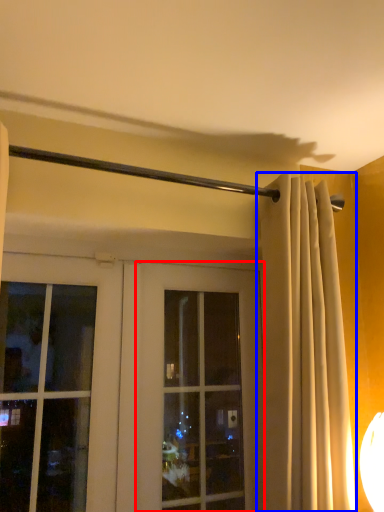
Question: Among these objects, which one is farthest to the camera, window (highlighted by a red box) or curtain (highlighted by a blue box)?

Choices:
 (A) window
 (B) curtain

Answer: (A)